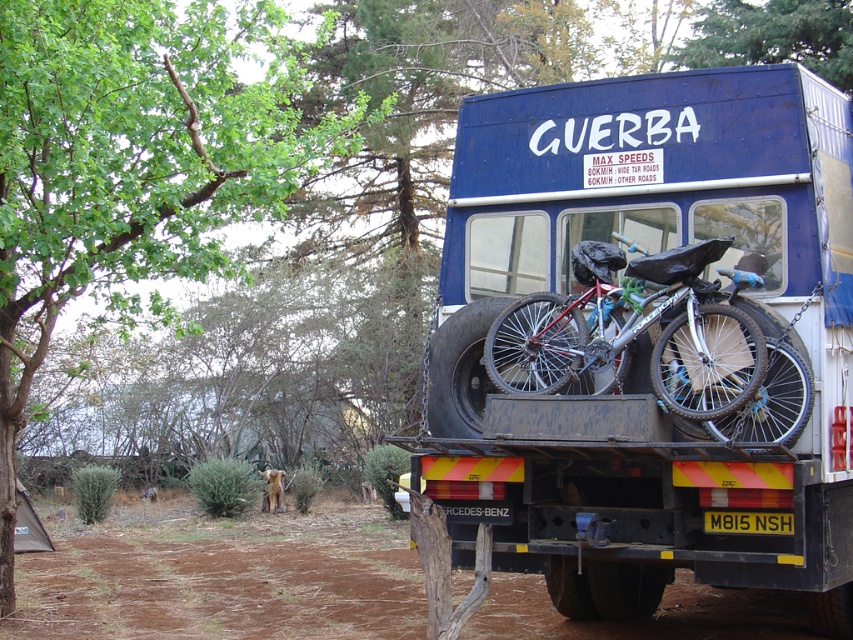
Question: Does blue matte trailer truck at center have a greater width compared to silver metallic bicycle at center?

Choices:
 (A) yes
 (B) no

Answer: (A)

Question: Where is blue matte trailer truck at center located in relation to silver metallic bicycle at center in the image?

Choices:
 (A) left
 (B) right

Answer: (B)

Question: Is blue matte trailer truck at center in front of silver metallic bicycle at center?

Choices:
 (A) no
 (B) yes

Answer: (B)

Question: Among these points, which one is nearest to the camera?

Choices:
 (A) (553, 554)
 (B) (665, 333)

Answer: (B)